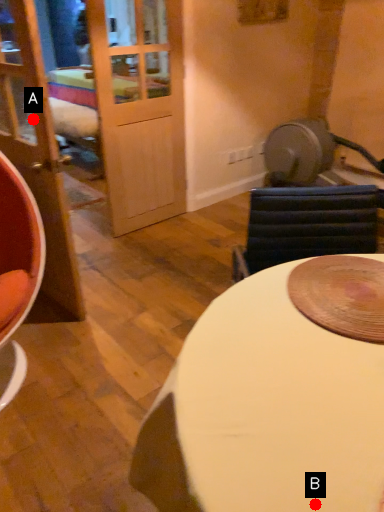
Question: Two points are circled on the image, labeled by A and B beside each circle. Which point is farther to the camera?

Choices:
 (A) A is further
 (B) B is further

Answer: (A)